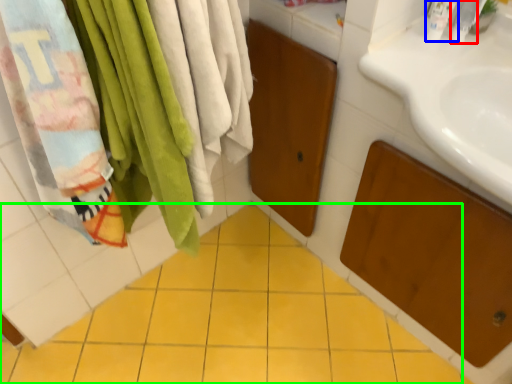
Question: Estimate the real-world distances between objects in this image. Which object is farther from toiletry (highlighted by a red box), toiletry (highlighted by a blue box) or ceramic tile (highlighted by a green box)?

Choices:
 (A) toiletry
 (B) ceramic tile

Answer: (B)